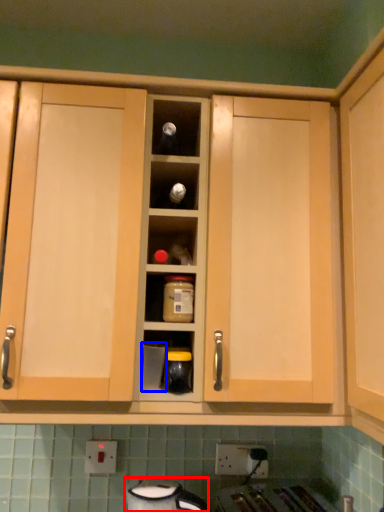
Question: Which object appears farthest to the camera in this image, appliance (highlighted by a red box) or appliance (highlighted by a blue box)?

Choices:
 (A) appliance
 (B) appliance

Answer: (B)